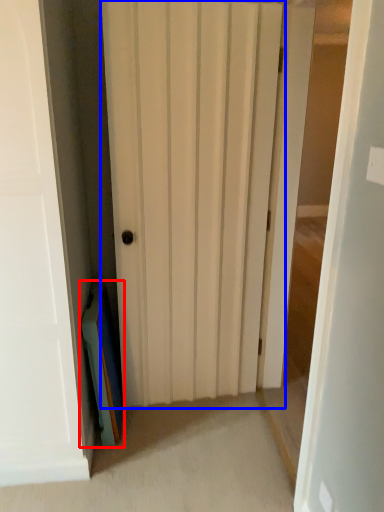
Question: Among these objects, which one is farthest to the camera, book (highlighted by a red box) or door (highlighted by a blue box)?

Choices:
 (A) book
 (B) door

Answer: (A)